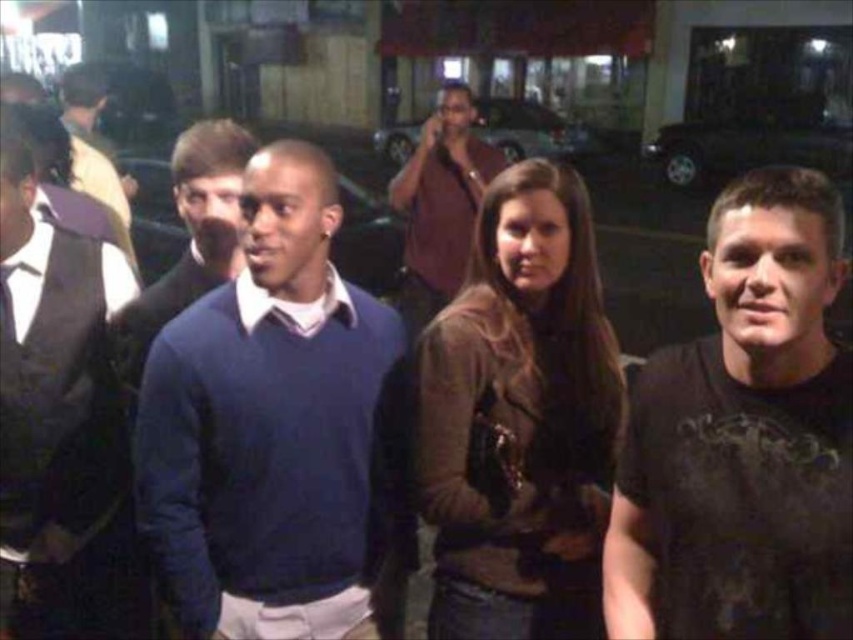
Is matte blue sweater at center above brown leather jacket at center?

Yes, matte blue sweater at center is above brown leather jacket at center.

Can you confirm if matte blue sweater at center is positioned to the left of brown leather jacket at center?

Correct, you'll find matte blue sweater at center to the left of brown leather jacket at center.

Locate an element on the screen. The height and width of the screenshot is (640, 853). matte blue sweater at center is located at coordinates (274, 426).

Can you confirm if metallic silver car at upper right is taller than metallic silver car at center?

Yes.

Is point (799, 129) farther from viewer compared to point (544, 122)?

No, it is in front of (544, 122).

This screenshot has height=640, width=853. Find the location of `metallic silver car at upper right`. metallic silver car at upper right is located at coordinates (755, 140).

Is point (426, 292) positioned before point (412, 147)?

Yes, it is.

Measure the distance between point (422, 161) and camera.

A distance of 3.91 meters exists between point (422, 161) and camera.

Between point (457, 179) and point (397, 163), which one is positioned in front?

Point (457, 179) is more forward.

Identify the location of matte brown shirt at center. This screenshot has height=640, width=853. (440, 204).